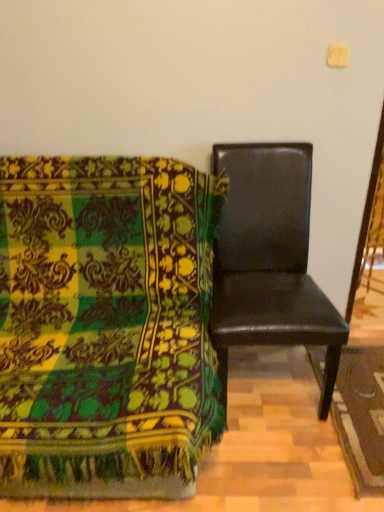
Question: Considering the relative positions of black leather chair at right, marked as the 2th chair in a right-to-left arrangement, and black leather chair at right, the 1th chair in the right-to-left sequence, in the image provided, is black leather chair at right, marked as the 2th chair in a right-to-left arrangement, to the left of black leather chair at right, the 1th chair in the right-to-left sequence, from the viewer's perspective?

Choices:
 (A) yes
 (B) no

Answer: (A)

Question: Could you tell me if black leather chair at right, marked as the 1th chair in a left-to-right arrangement, is facing black leather chair at right, the 1th chair in the right-to-left sequence?

Choices:
 (A) yes
 (B) no

Answer: (B)

Question: Is the position of black leather chair at right, marked as the 2th chair in a right-to-left arrangement, less distant than that of black leather chair at right, the 1th chair in the right-to-left sequence?

Choices:
 (A) no
 (B) yes

Answer: (B)

Question: Is black leather chair at right, marked as the 1th chair in a left-to-right arrangement, not within black leather chair at right, the 2th chair when ordered from left to right?

Choices:
 (A) no
 (B) yes

Answer: (B)

Question: From the image's perspective, is black leather chair at right, marked as the 2th chair in a right-to-left arrangement, located beneath black leather chair at right, the 1th chair in the right-to-left sequence?

Choices:
 (A) yes
 (B) no

Answer: (A)

Question: Is black leather chair at right, marked as the 2th chair in a right-to-left arrangement, oriented away from black leather chair at right, the 2th chair when ordered from left to right?

Choices:
 (A) yes
 (B) no

Answer: (B)

Question: Considering the relative sizes of black leather chair at right, the 1th chair in the right-to-left sequence, and black leather chair at right, marked as the 2th chair in a right-to-left arrangement, in the image provided, is black leather chair at right, the 1th chair in the right-to-left sequence, thinner than black leather chair at right, marked as the 2th chair in a right-to-left arrangement,?

Choices:
 (A) no
 (B) yes

Answer: (B)

Question: Does black leather chair at right, the 2th chair when ordered from left to right, appear on the left side of black leather chair at right, marked as the 1th chair in a left-to-right arrangement?

Choices:
 (A) no
 (B) yes

Answer: (A)

Question: Is black leather chair at right, the 1th chair in the right-to-left sequence, aimed at black leather chair at right, marked as the 1th chair in a left-to-right arrangement?

Choices:
 (A) yes
 (B) no

Answer: (B)

Question: Does black leather chair at right, the 1th chair in the right-to-left sequence, have a lesser height compared to black leather chair at right, marked as the 2th chair in a right-to-left arrangement?

Choices:
 (A) yes
 (B) no

Answer: (B)

Question: Is black leather chair at right, the 2th chair when ordered from left to right, positioned in front of black leather chair at right, marked as the 1th chair in a left-to-right arrangement?

Choices:
 (A) yes
 (B) no

Answer: (B)

Question: Is black leather chair at right, marked as the 2th chair in a right-to-left arrangement, completely or partially inside black leather chair at right, the 1th chair in the right-to-left sequence?

Choices:
 (A) no
 (B) yes

Answer: (A)

Question: From a real-world perspective, is black leather chair at right, marked as the 2th chair in a right-to-left arrangement, above or below black leather chair at right, the 2th chair when ordered from left to right?

Choices:
 (A) below
 (B) above

Answer: (A)